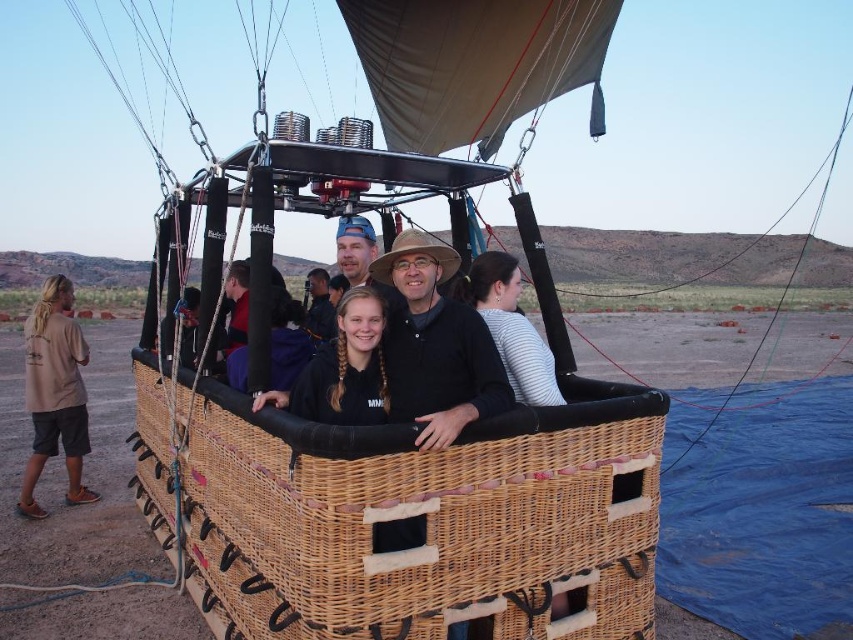
Question: Is beige cotton shirt at left wider than white striped shirt at center?

Choices:
 (A) no
 (B) yes

Answer: (B)

Question: Is black fleece jacket at center to the right of white striped shirt at center from the viewer's perspective?

Choices:
 (A) no
 (B) yes

Answer: (A)

Question: Which object is closer to the camera taking this photo?

Choices:
 (A) white striped shirt at center
 (B) beige cotton shirt at left
 (C) woven wicker basket at center
 (D) black fleece jacket at center

Answer: (C)

Question: Which of the following is the farthest from the observer?

Choices:
 (A) white striped shirt at center
 (B) black fleece jacket at center
 (C) woven wicker basket at center

Answer: (A)

Question: Can you confirm if woven wicker basket at center is wider than white striped shirt at center?

Choices:
 (A) yes
 (B) no

Answer: (A)

Question: Which point is farther to the camera?

Choices:
 (A) woven wicker basket at center
 (B) black fleece jacket at center

Answer: (B)